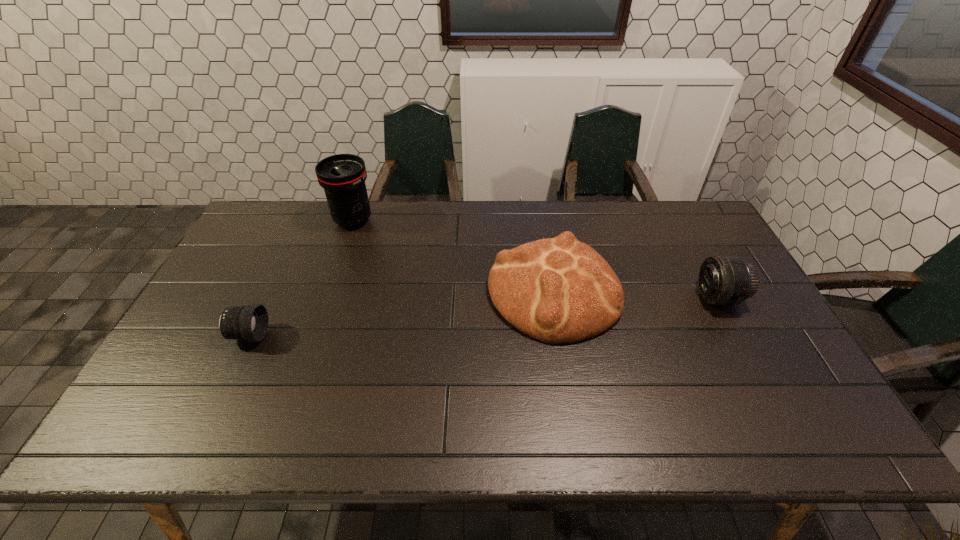
This screenshot has height=540, width=960. In the image, there is a desktop. What are the coordinates of `vacant space at the near right corner` in the screenshot? It's located at (776, 423).

This screenshot has height=540, width=960. I want to click on free space between the bread and the tallest telephoto lens, so click(x=454, y=256).

At what (x,y) coordinates should I click in order to perform the action: click on vacant point located between the leftmost telephoto lens and the bread. Please return your answer as a coordinate pair (x, y). Image resolution: width=960 pixels, height=540 pixels. Looking at the image, I should click on (401, 314).

Where is `vacant space that is in between the second farthest telephoto lens and the leftmost object`? The width and height of the screenshot is (960, 540). vacant space that is in between the second farthest telephoto lens and the leftmost object is located at coordinates (484, 316).

This screenshot has height=540, width=960. I want to click on blank region between the leftmost telephoto lens and the third object from right to left, so click(x=301, y=278).

Where is `blank region between the second object from right to left and the second nearest telephoto lens`? The width and height of the screenshot is (960, 540). blank region between the second object from right to left and the second nearest telephoto lens is located at coordinates (636, 295).

Identify the location of unoccupied area between the leftmost telephoto lens and the bread. The height and width of the screenshot is (540, 960). (401, 314).

Where is `unoccupied area between the shortest telephoto lens and the rightmost telephoto lens`? This screenshot has height=540, width=960. unoccupied area between the shortest telephoto lens and the rightmost telephoto lens is located at coordinates (484, 316).

Locate an element on the screen. This screenshot has width=960, height=540. vacant space that is in between the farthest object and the leftmost object is located at coordinates (301, 278).

At what (x,y) coordinates should I click in order to perform the action: click on unoccupied area between the farthest object and the bread. Please return your answer as a coordinate pair (x, y). The width and height of the screenshot is (960, 540). Looking at the image, I should click on (454, 256).